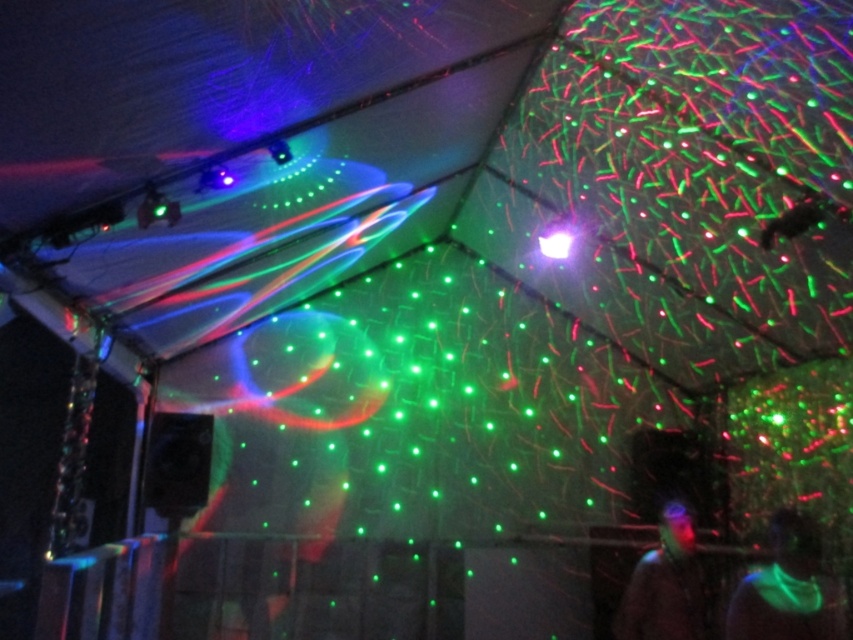
Question: Is neon green glowing vest at lower right smaller than translucent plastic head at center?

Choices:
 (A) no
 (B) yes

Answer: (A)

Question: Which object appears closest to the camera in this image?

Choices:
 (A) translucent plastic head at center
 (B) neon green glowing vest at lower right

Answer: (B)

Question: Does neon green glowing vest at lower right appear on the left side of translucent plastic head at center?

Choices:
 (A) no
 (B) yes

Answer: (A)

Question: Is the position of neon green glowing vest at lower right more distant than that of translucent plastic head at center?

Choices:
 (A) yes
 (B) no

Answer: (B)

Question: Which point is closer to the camera taking this photo?

Choices:
 (A) (637, 625)
 (B) (740, 586)

Answer: (B)